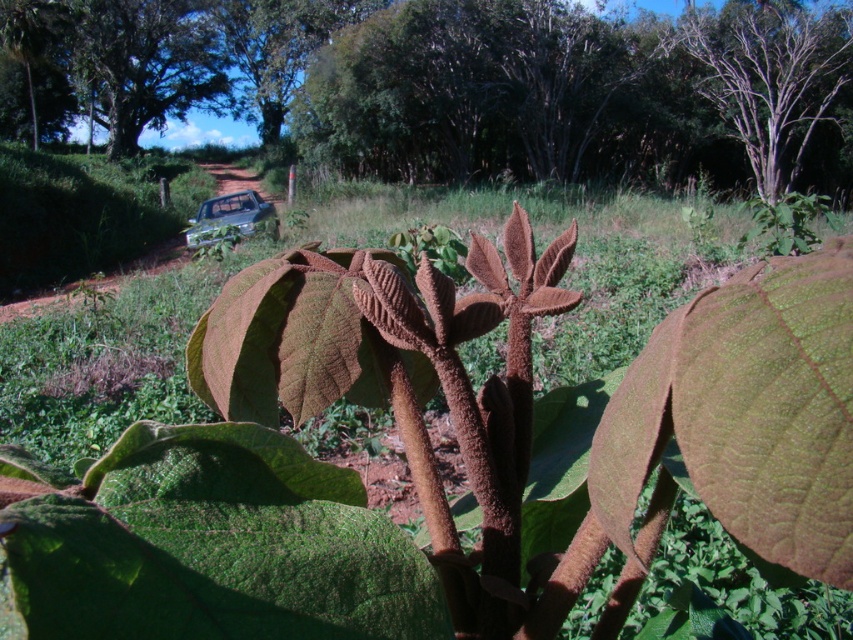
Question: Is the position of brown bark tree at upper right more distant than that of metallic silver car at center?

Choices:
 (A) no
 (B) yes

Answer: (B)

Question: Which point is farther to the camera?

Choices:
 (A) brown bark tree at upper right
 (B) metallic silver car at center

Answer: (A)

Question: Which object appears closest to the camera in this image?

Choices:
 (A) metallic silver car at center
 (B) brown bark tree at upper right

Answer: (A)

Question: Considering the relative positions of brown bark tree at upper right and metallic silver car at center in the image provided, where is brown bark tree at upper right located with respect to metallic silver car at center?

Choices:
 (A) right
 (B) left

Answer: (A)

Question: Can you confirm if brown bark tree at upper right is positioned to the left of metallic silver car at center?

Choices:
 (A) no
 (B) yes

Answer: (A)